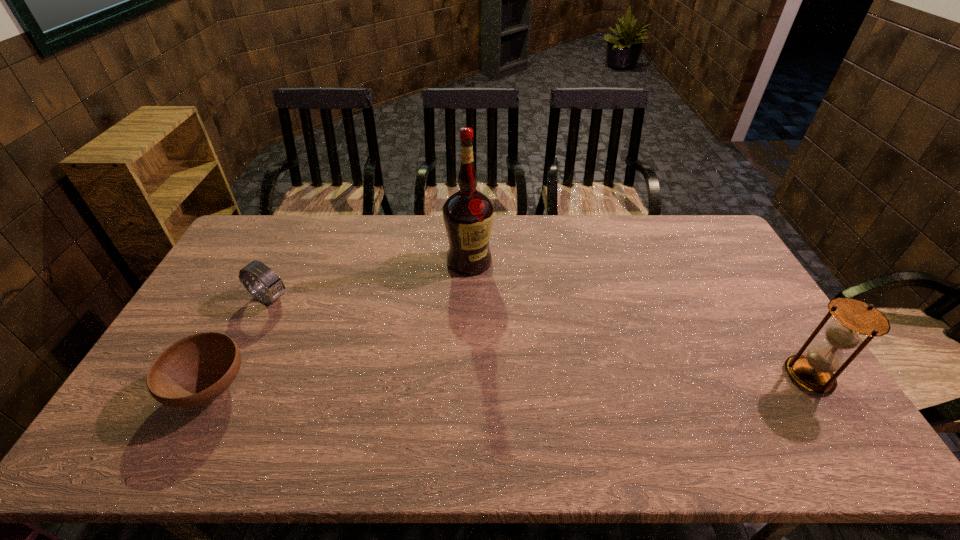
This screenshot has height=540, width=960. Identify the location of the shortest object. (197, 369).

You are a GUI agent. You are given a task and a screenshot of the screen. Output one action in this format:
    pyautogui.click(x=<x>, y=<y>)
    Task: Click on the hourglass
    The height and width of the screenshot is (540, 960).
    Given the screenshot: What is the action you would take?
    pyautogui.click(x=814, y=371)

In order to click on the rightmost object in this screenshot , I will do `click(814, 371)`.

I want to click on the third object from left to right, so click(x=468, y=215).

Find the location of `alcohol`. alcohol is located at coordinates (468, 215).

Identify the location of watch. This screenshot has width=960, height=540. (274, 287).

At what (x,y) coordinates should I click in order to perform the action: click on the second shortest object. Please return your answer as a coordinate pair (x, y). Image resolution: width=960 pixels, height=540 pixels. Looking at the image, I should click on (274, 287).

Find the location of a particular element. free spot located 0.380m on the right of the shortest object is located at coordinates coord(395,389).

Where is `vacant region located 0.370m on the left of the second tallest object`? The image size is (960, 540). vacant region located 0.370m on the left of the second tallest object is located at coordinates (649, 376).

Where is `vacant point located 0.090m on the label of the third object from left to right`? Image resolution: width=960 pixels, height=540 pixels. vacant point located 0.090m on the label of the third object from left to right is located at coordinates (462, 296).